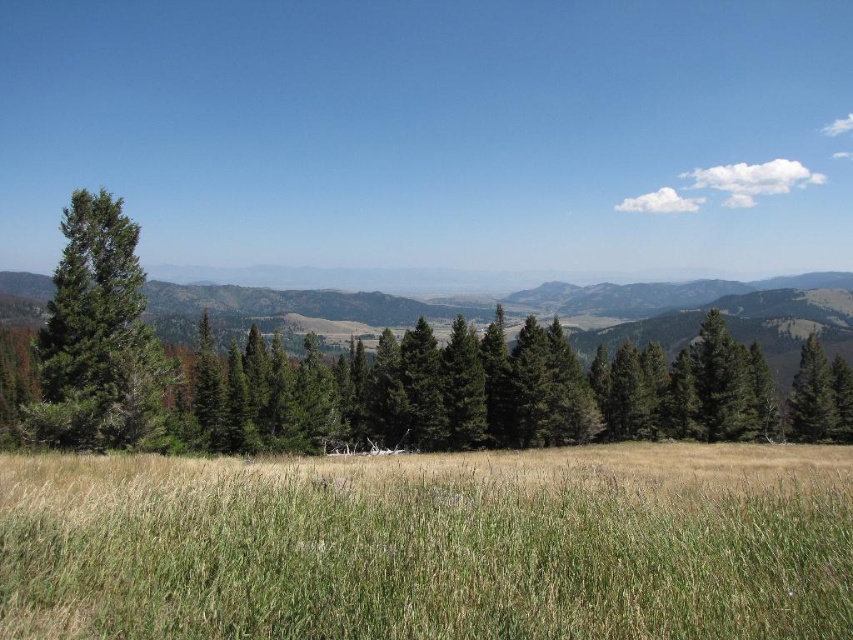
Question: Is green grassy field at center to the left of green matte tree at left from the viewer's perspective?

Choices:
 (A) no
 (B) yes

Answer: (A)

Question: Can you confirm if green grassy field at center is positioned above green matte tree at left?

Choices:
 (A) no
 (B) yes

Answer: (A)

Question: Which object appears farthest from the camera in this image?

Choices:
 (A) green matte tree at left
 (B) green grassy field at center

Answer: (A)

Question: Is green grassy field at center to the right of green matte tree at left from the viewer's perspective?

Choices:
 (A) no
 (B) yes

Answer: (B)